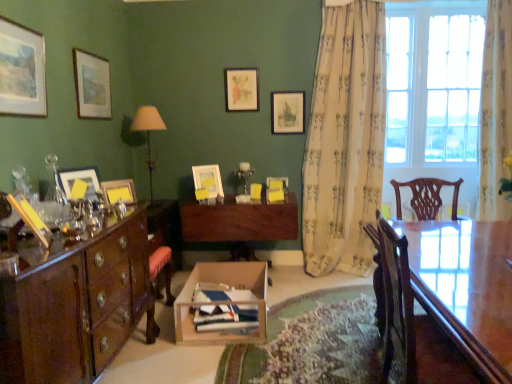
What do you see at coordinates (241, 89) in the screenshot?
I see `matte pink picture frame at upper center, the seventh picture frame in the front-to-back sequence` at bounding box center [241, 89].

What is the approximate width of cardboard box at center?

The width of cardboard box at center is 24.23 inches.

Image resolution: width=512 pixels, height=384 pixels. Describe the element at coordinates (288, 112) in the screenshot. I see `matte black picture frame at upper center, which ranks as the 1th picture frame in right-to-left order` at that location.

Image resolution: width=512 pixels, height=384 pixels. In order to click on matte yellow picture frame at left, positioned as the 5th picture frame in right-to-left order in this screenshot , I will do `click(119, 191)`.

Image resolution: width=512 pixels, height=384 pixels. What do you see at coordinates (148, 133) in the screenshot?
I see `matte cream fabric lampshade at left` at bounding box center [148, 133].

Identify the location of matte cream fabric lampshade at left. The width and height of the screenshot is (512, 384). (148, 133).

Find the location of a particular element. This screenshot has width=512, height=384. matte pink picture frame at upper center, the sixth picture frame viewed from the left is located at coordinates (241, 89).

Is clear glass window at right smaller than matte pink picture frame at upper center, the seventh picture frame in the front-to-back sequence?

No, clear glass window at right is not smaller than matte pink picture frame at upper center, the seventh picture frame in the front-to-back sequence.

Would you say clear glass window at right is to the left or to the right of matte pink picture frame at upper center, the 2th picture frame in the back-to-front sequence, in the picture?

clear glass window at right is positioned on matte pink picture frame at upper center, the 2th picture frame in the back-to-front sequence,'s right side.

Looking at this image, can matte pink picture frame at upper center, the 2th picture frame in the back-to-front sequence, be found inside clear glass window at right?

Actually, matte pink picture frame at upper center, the 2th picture frame in the back-to-front sequence, is outside clear glass window at right.

From the image's perspective, which one is positioned lower, clear glass window at right or matte pink picture frame at upper center, the 2th picture frame in the back-to-front sequence?

clear glass window at right is shown below in the image.

Based on their sizes in the image, would you say matte white picture frame at left, which is the third picture frame from left to right, is bigger or smaller than floral fabric curtain at right, which appears as the second curtain when viewed from the left?

matte white picture frame at left, which is the third picture frame from left to right, is smaller than floral fabric curtain at right, which appears as the second curtain when viewed from the left.

Can you confirm if matte white picture frame at left, which is the third picture frame from left to right, is shorter than floral fabric curtain at right, which appears as the first curtain when viewed from the right?

Indeed, matte white picture frame at left, which is the third picture frame from left to right, has a lesser height compared to floral fabric curtain at right, which appears as the first curtain when viewed from the right.

Are matte white picture frame at left, which is the third picture frame from left to right, and floral fabric curtain at right, which appears as the first curtain when viewed from the right, beside each other?

No, matte white picture frame at left, which is the third picture frame from left to right, is not in contact with floral fabric curtain at right, which appears as the first curtain when viewed from the right.

How different are the orientations of matte white picture frame at left, marked as the 6th picture frame in a right-to-left arrangement, and floral fabric curtain at right, which appears as the second curtain when viewed from the left, in degrees?

64.6 degrees.

Measure the distance between matte yellow picture frame at center, the fourth picture frame viewed from the back, and cardboard box at center.

matte yellow picture frame at center, the fourth picture frame viewed from the back, is 36.55 inches from cardboard box at center.

Is matte yellow picture frame at center, acting as the 5th picture frame starting from the front, not near cardboard box at center?

Actually, matte yellow picture frame at center, acting as the 5th picture frame starting from the front, and cardboard box at center are a little close together.

The image size is (512, 384). In order to click on cardboard box below the matte yellow picture frame at center, acting as the 4th picture frame starting from the right (from the image's perspective) in this screenshot , I will do `click(204, 303)`.

From the image's perspective, would you say matte yellow picture frame at center, acting as the 5th picture frame starting from the front, is positioned over cardboard box at center?

Yes.

Looking at the image, does matte white picture frame at upper left, the eighth picture frame positioned from the right, seem bigger or smaller compared to floral fabric curtain at right, which appears as the second curtain when viewed from the left?

Considering their sizes, matte white picture frame at upper left, the eighth picture frame positioned from the right, takes up less space than floral fabric curtain at right, which appears as the second curtain when viewed from the left.

Considering the positions of objects matte white picture frame at upper left, which is the eighth picture frame from back to front, and floral fabric curtain at right, which appears as the second curtain when viewed from the left, in the image provided, who is more to the left, matte white picture frame at upper left, which is the eighth picture frame from back to front, or floral fabric curtain at right, which appears as the second curtain when viewed from the left,?

From the viewer's perspective, matte white picture frame at upper left, which is the eighth picture frame from back to front, appears more on the left side.

Considering the positions of objects matte white picture frame at upper left, which is the eighth picture frame from back to front, and floral fabric curtain at right, which appears as the first curtain when viewed from the right, in the image provided, who is behind, matte white picture frame at upper left, which is the eighth picture frame from back to front, or floral fabric curtain at right, which appears as the first curtain when viewed from the right,?

floral fabric curtain at right, which appears as the first curtain when viewed from the right, is further from the camera.

How different are the orientations of cardboard box at center and matte black picture frame at upper center, the eighth picture frame positioned from the left, in degrees?

The facing directions of cardboard box at center and matte black picture frame at upper center, the eighth picture frame positioned from the left, are 91.2 degrees apart.

Identify the location of the 5th picture frame positioned above the cardboard box at center (from a real-world perspective). point(288,112).

Looking at this image, could you tell me if cardboard box at center is turned towards matte black picture frame at upper center, which ranks as the 1th picture frame in right-to-left order?

No, cardboard box at center is not aimed at matte black picture frame at upper center, which ranks as the 1th picture frame in right-to-left order.

Considering the sizes of objects cardboard box at center and matte black picture frame at upper center, which ranks as the 1th picture frame in right-to-left order, in the image provided, who is wider, cardboard box at center or matte black picture frame at upper center, which ranks as the 1th picture frame in right-to-left order,?

cardboard box at center.

Can we say matte pink picture frame at upper center, the third picture frame in the right-to-left sequence, lies outside matte white picture frame at upper left, which is the eighth picture frame from back to front?

Yes, matte pink picture frame at upper center, the third picture frame in the right-to-left sequence, is not within matte white picture frame at upper left, which is the eighth picture frame from back to front.

Which is behind, matte pink picture frame at upper center, the seventh picture frame in the front-to-back sequence, or matte white picture frame at upper left, the eighth picture frame positioned from the right?

matte pink picture frame at upper center, the seventh picture frame in the front-to-back sequence.

How many degrees apart are the facing directions of matte pink picture frame at upper center, the 2th picture frame in the back-to-front sequence, and matte white picture frame at upper left, marked as the first picture frame in a front-to-back arrangement?

The angle between the facing direction of matte pink picture frame at upper center, the 2th picture frame in the back-to-front sequence, and the facing direction of matte white picture frame at upper left, marked as the first picture frame in a front-to-back arrangement, is 91.5 degrees.

Who is bigger, matte pink picture frame at upper center, the 2th picture frame in the back-to-front sequence, or matte white picture frame at upper left, marked as the first picture frame in a front-to-back arrangement?

Bigger between the two is matte white picture frame at upper left, marked as the first picture frame in a front-to-back arrangement.

Considering the relative sizes of matte white picture frame at center, which ranks as the sixth picture frame in front-to-back order, and matte black picture frame at upper center, the eighth picture frame positioned from the left, in the image provided, is matte white picture frame at center, which ranks as the sixth picture frame in front-to-back order, thinner than matte black picture frame at upper center, the eighth picture frame positioned from the left,?

Incorrect, the width of matte white picture frame at center, which ranks as the sixth picture frame in front-to-back order, is not less than that of matte black picture frame at upper center, the eighth picture frame positioned from the left.

Is matte white picture frame at center, arranged as the 7th picture frame when viewed from the left, situated inside matte black picture frame at upper center, marked as the eighth picture frame in a front-to-back arrangement, or outside?

matte white picture frame at center, arranged as the 7th picture frame when viewed from the left, is outside matte black picture frame at upper center, marked as the eighth picture frame in a front-to-back arrangement.

I want to click on the 4th picture frame directly beneath the matte black picture frame at upper center, marked as the eighth picture frame in a front-to-back arrangement (from a real-world perspective), so click(x=280, y=180).

The height and width of the screenshot is (384, 512). Identify the location of window lying below the matte pink picture frame at upper center, the 2th picture frame in the back-to-front sequence (from the image's perspective). click(433, 81).

You are a GUI agent. You are given a task and a screenshot of the screen. Output one action in this format:
    pyautogui.click(x=<x>, y=<y>)
    Task: Click on the picture frame that is the 6th object to the left of the floral fabric curtain at right, which appears as the second curtain when viewed from the left, starting at the anchor
    This screenshot has width=512, height=384.
    Given the screenshot: What is the action you would take?
    pyautogui.click(x=80, y=179)

Which object lies further to the anchor point matte yellow picture frame at center, acting as the 4th picture frame starting from the right, matte paper picture frame at upper left, acting as the 4th picture frame starting from the front, or matte black picture frame at upper center, the eighth picture frame positioned from the left?

matte paper picture frame at upper left, acting as the 4th picture frame starting from the front, lies further to matte yellow picture frame at center, acting as the 4th picture frame starting from the right, than the other object.

From the image, which object appears to be farther from matte black picture frame at upper center, which ranks as the 1th picture frame in right-to-left order, matte white picture frame at left, which is the third picture frame from left to right, or floral-patterned fabric curtain at right, marked as the 1th curtain in a left-to-right arrangement?

Among the two, matte white picture frame at left, which is the third picture frame from left to right, is located further to matte black picture frame at upper center, which ranks as the 1th picture frame in right-to-left order.

Based on the photo, based on their spatial positions, is floral-patterned fabric curtain at right, marked as the 1th curtain in a left-to-right arrangement, or matte yellow picture frame at center, which is counted as the fifth picture frame, starting from the left, further from matte white picture frame at upper left, the eighth picture frame positioned from the right?

floral-patterned fabric curtain at right, marked as the 1th curtain in a left-to-right arrangement.

Looking at the image, which one is located further to floral fabric curtain at right, which appears as the first curtain when viewed from the right, matte white picture frame at left, marked as the 6th picture frame in a right-to-left arrangement, or glossy wood table at right?

matte white picture frame at left, marked as the 6th picture frame in a right-to-left arrangement, lies further to floral fabric curtain at right, which appears as the first curtain when viewed from the right, than the other object.

Consider the image. From the image, which object appears to be farther from floral fabric curtain at right, which appears as the second curtain when viewed from the left, matte white picture frame at left, marked as the 6th picture frame in a right-to-left arrangement, or floral-patterned fabric curtain at right, marked as the 1th curtain in a left-to-right arrangement?

The object further to floral fabric curtain at right, which appears as the second curtain when viewed from the left, is matte white picture frame at left, marked as the 6th picture frame in a right-to-left arrangement.

When comparing their distances from matte white picture frame at upper left, arranged as the 1th picture frame when viewed from the left, does matte black picture frame at upper center, which is counted as the first picture frame, starting from the back, or matte cream fabric lampshade at left seem further?

matte black picture frame at upper center, which is counted as the first picture frame, starting from the back.

When comparing their distances from matte yellow picture frame at left, arranged as the third picture frame when viewed from the front, does cardboard box at center or matte cream fabric lampshade at left seem closer?

Based on the image, matte cream fabric lampshade at left appears to be nearer to matte yellow picture frame at left, arranged as the third picture frame when viewed from the front.

When comparing their distances from polished wood cabinet at left, does matte pink picture frame at upper center, the sixth picture frame viewed from the left, or glossy wood table at right seem further?

Based on the image, matte pink picture frame at upper center, the sixth picture frame viewed from the left, appears to be further to polished wood cabinet at left.

Identify the location of window between matte white picture frame at upper left, marked as the first picture frame in a front-to-back arrangement, and floral fabric curtain at right, which appears as the second curtain when viewed from the left. (433, 81).

The width and height of the screenshot is (512, 384). In order to click on desk between cardboard box at center and matte yellow picture frame at center, acting as the 4th picture frame starting from the right, along the z-axis in this screenshot , I will do `click(240, 223)`.

At what (x,y) coordinates should I click in order to perform the action: click on desk between glossy wood table at right and matte pink picture frame at upper center, the seventh picture frame in the front-to-back sequence, in the front-back direction. Please return your answer as a coordinate pair (x, y). Looking at the image, I should click on (240, 223).

The height and width of the screenshot is (384, 512). I want to click on table between matte white picture frame at left, which is counted as the 2th picture frame, starting from the front, and floral-patterned fabric curtain at right, which is the 2th curtain in right-to-left order, from left to right, so click(x=464, y=288).